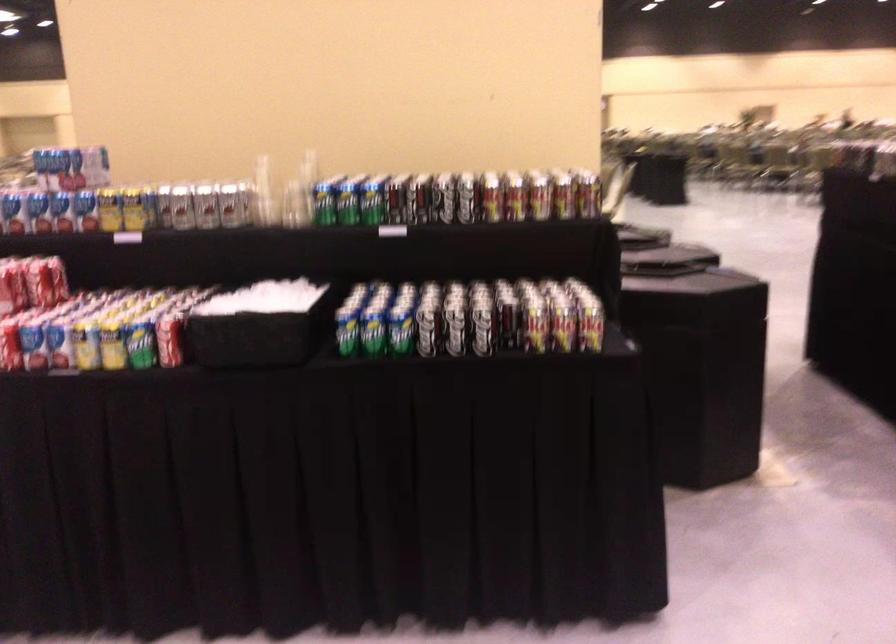
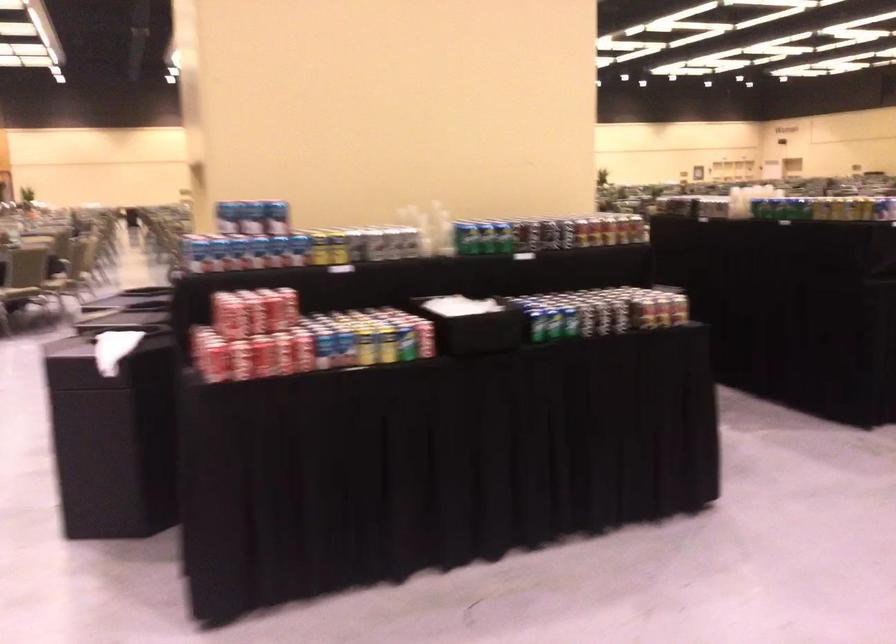
Locate, in the second image, the point that corresponds to point (183, 205) in the first image.

(375, 243)